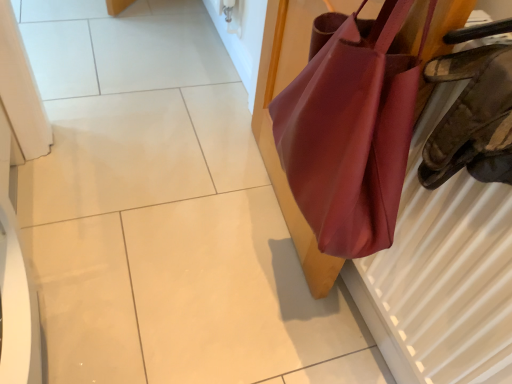
Question: From a real-world perspective, does matte leather handbag at right sit lower than matte brown radiator at right?

Choices:
 (A) no
 (B) yes

Answer: (B)

Question: From a real-world perspective, is matte leather handbag at right located higher than matte brown radiator at right?

Choices:
 (A) no
 (B) yes

Answer: (A)

Question: From the image's perspective, is matte leather handbag at right below matte brown radiator at right?

Choices:
 (A) yes
 (B) no

Answer: (B)

Question: Considering the relative positions of matte leather handbag at right and matte brown radiator at right in the image provided, is matte leather handbag at right to the left of matte brown radiator at right from the viewer's perspective?

Choices:
 (A) no
 (B) yes

Answer: (B)

Question: From the image's perspective, is matte leather handbag at right located above matte brown radiator at right?

Choices:
 (A) yes
 (B) no

Answer: (A)

Question: Does matte leather handbag at right have a smaller size compared to matte brown radiator at right?

Choices:
 (A) yes
 (B) no

Answer: (B)

Question: Is matte brown radiator at right behind matte leather handbag at right?

Choices:
 (A) yes
 (B) no

Answer: (B)

Question: Does matte brown radiator at right contain matte leather handbag at right?

Choices:
 (A) yes
 (B) no

Answer: (B)

Question: Is matte brown radiator at right at the left side of matte leather handbag at right?

Choices:
 (A) yes
 (B) no

Answer: (B)

Question: Is matte brown radiator at right looking in the opposite direction of matte leather handbag at right?

Choices:
 (A) no
 (B) yes

Answer: (B)

Question: Does matte brown radiator at right have a lesser height compared to matte leather handbag at right?

Choices:
 (A) no
 (B) yes

Answer: (B)

Question: From a real-world perspective, is matte brown radiator at right physically below matte leather handbag at right?

Choices:
 (A) no
 (B) yes

Answer: (A)

Question: Based on their sizes in the image, would you say matte leather handbag at right is bigger or smaller than matte brown radiator at right?

Choices:
 (A) small
 (B) big

Answer: (B)